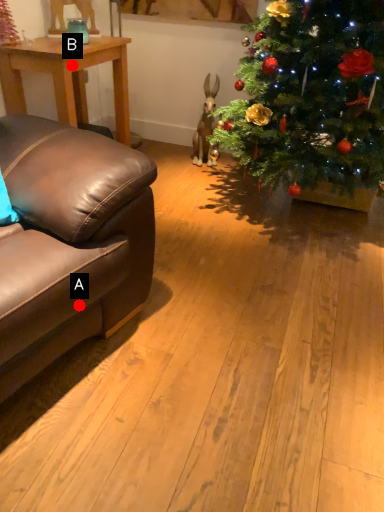
Question: Two points are circled on the image, labeled by A and B beside each circle. Which point is farther from the camera taking this photo?

Choices:
 (A) A is further
 (B) B is further

Answer: (B)